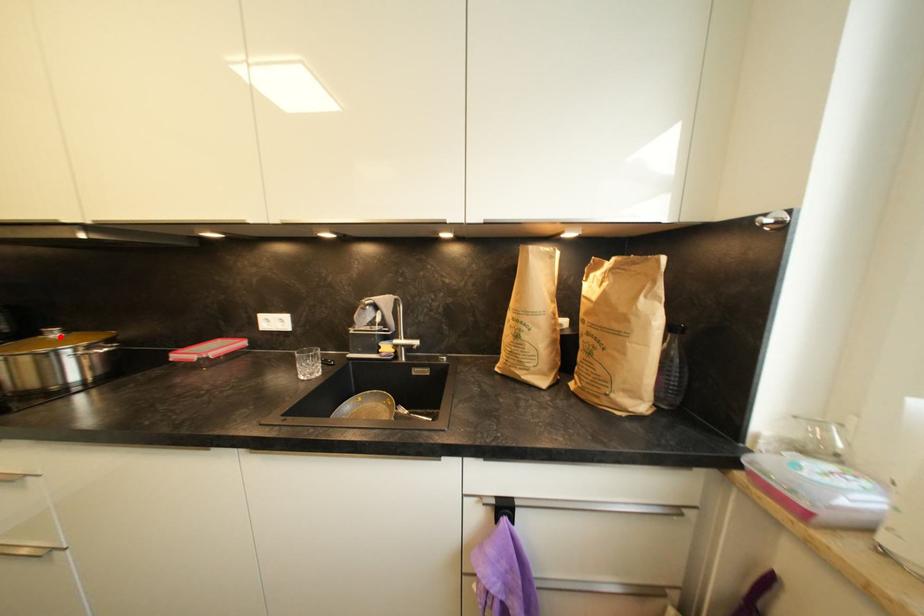
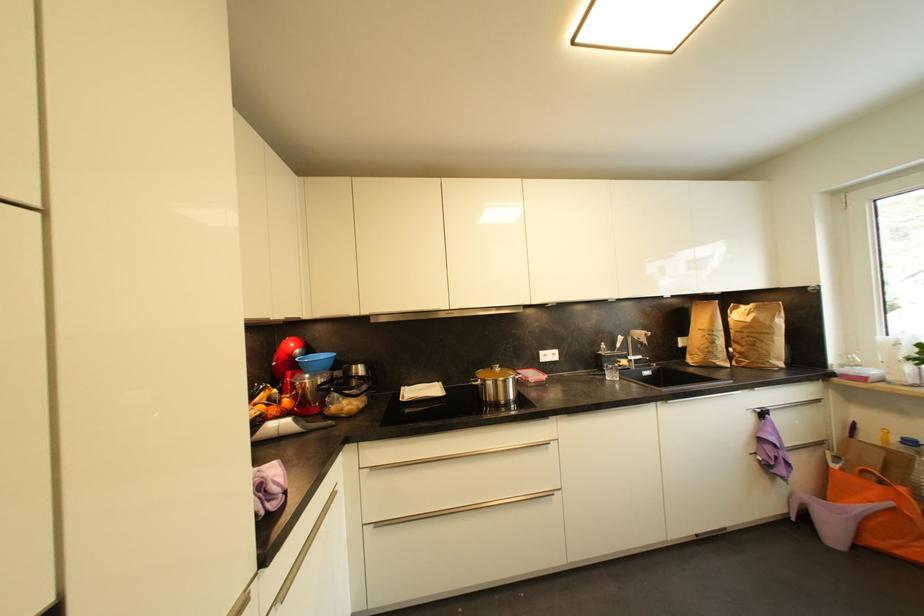
Find the pixel in the second image that matches the highlighted location in the first image.

(503, 371)